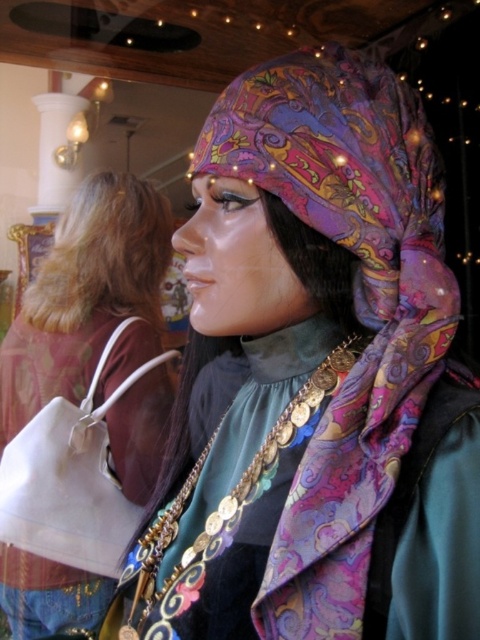
Question: Does paisley-patterned scarf at center have a smaller size compared to matte white bag at left?

Choices:
 (A) no
 (B) yes

Answer: (B)

Question: Which point is farther from the camera taking this photo?

Choices:
 (A) (277, 328)
 (B) (140, 308)

Answer: (B)

Question: Does paisley-patterned scarf at center appear over matte white bag at left?

Choices:
 (A) yes
 (B) no

Answer: (A)

Question: Can you confirm if paisley-patterned scarf at center is positioned to the left of matte white bag at left?

Choices:
 (A) no
 (B) yes

Answer: (A)

Question: Which point appears farthest from the camera in this image?

Choices:
 (A) (408, 381)
 (B) (88, 266)

Answer: (B)

Question: Among these objects, which one is farthest from the camera?

Choices:
 (A) matte white bag at left
 (B) paisley-patterned scarf at center

Answer: (A)